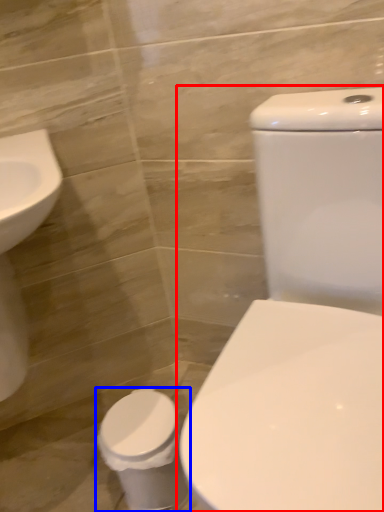
Question: Which object appears farthest to the camera in this image, toilet (highlighted by a red box) or toilet bowl (highlighted by a blue box)?

Choices:
 (A) toilet
 (B) toilet bowl

Answer: (B)